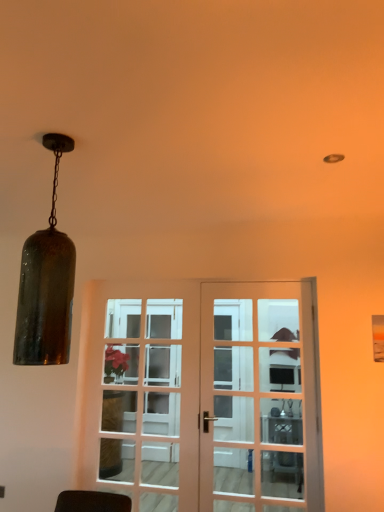
Question: In which direction should I rotate to look at wooden glass door at center, arranged as the 1th door when viewed from the left?

Choices:
 (A) right
 (B) left

Answer: (A)

Question: Considering the relative sizes of amber glass pendant light at left and wooden glass door at center, arranged as the 1th door when viewed from the left, in the image provided, is amber glass pendant light at left taller than wooden glass door at center, arranged as the 1th door when viewed from the left,?

Choices:
 (A) no
 (B) yes

Answer: (A)

Question: Does amber glass pendant light at left appear on the left side of wooden glass door at center, which is the second door from right to left?

Choices:
 (A) no
 (B) yes

Answer: (B)

Question: Is wooden glass door at center, arranged as the 1th door when viewed from the left, located within amber glass pendant light at left?

Choices:
 (A) yes
 (B) no

Answer: (B)

Question: From a real-world perspective, is amber glass pendant light at left physically below wooden glass door at center, which is the second door from right to left?

Choices:
 (A) no
 (B) yes

Answer: (A)

Question: From the image's perspective, would you say amber glass pendant light at left is shown under wooden glass door at center, arranged as the 1th door when viewed from the left?

Choices:
 (A) yes
 (B) no

Answer: (B)

Question: Considering the relative sizes of amber glass pendant light at left and wooden glass door at center, which is the second door from right to left, in the image provided, is amber glass pendant light at left smaller than wooden glass door at center, which is the second door from right to left,?

Choices:
 (A) no
 (B) yes

Answer: (B)

Question: Is metallic silver table at center to the right of amber glass pendant light at left from the viewer's perspective?

Choices:
 (A) no
 (B) yes

Answer: (B)

Question: Does metallic silver table at center lie in front of amber glass pendant light at left?

Choices:
 (A) yes
 (B) no

Answer: (B)

Question: Can you confirm if metallic silver table at center is thinner than amber glass pendant light at left?

Choices:
 (A) yes
 (B) no

Answer: (B)

Question: Does metallic silver table at center have a larger size compared to amber glass pendant light at left?

Choices:
 (A) no
 (B) yes

Answer: (B)

Question: Can you confirm if metallic silver table at center is smaller than amber glass pendant light at left?

Choices:
 (A) no
 (B) yes

Answer: (A)

Question: Could you tell me if metallic silver table at center is facing amber glass pendant light at left?

Choices:
 (A) yes
 (B) no

Answer: (A)

Question: Is amber glass pendant light at left far away from matte white door at center, marked as the second door in a left-to-right arrangement?

Choices:
 (A) no
 (B) yes

Answer: (B)